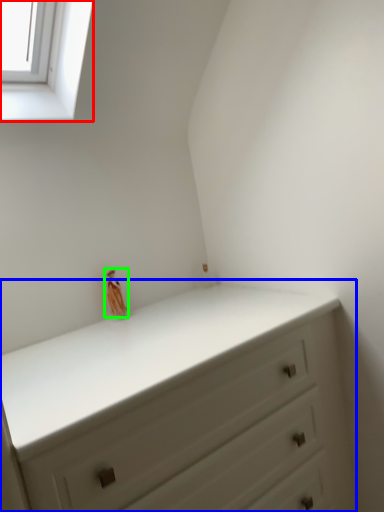
Question: Considering the real-world distances, which object is farthest from window (highlighted by a red box)? chest of drawers (highlighted by a blue box) or miniature (highlighted by a green box)?

Choices:
 (A) chest of drawers
 (B) miniature

Answer: (A)